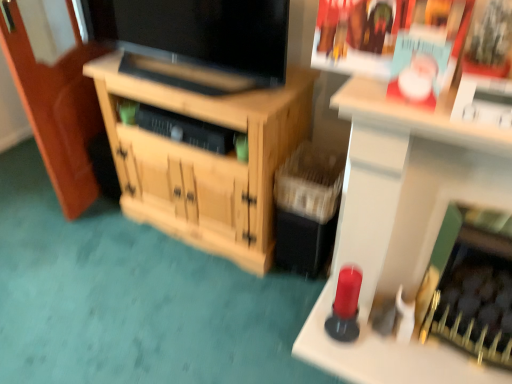
Image resolution: width=512 pixels, height=384 pixels. I want to click on free region under matte black tv at center (from a real-world perspective), so click(190, 81).